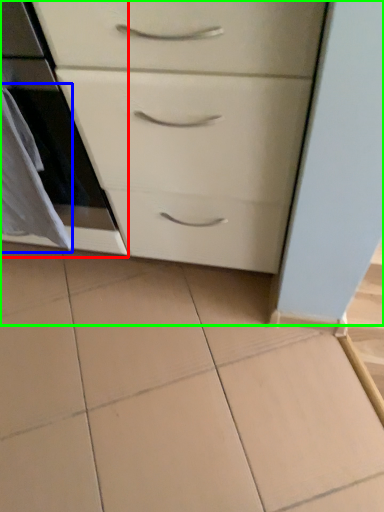
Question: Which object is the closest to the oven (highlighted by a red box)? Choose among these: material (highlighted by a blue box) or chest of drawers (highlighted by a green box).

Choices:
 (A) material
 (B) chest of drawers

Answer: (A)